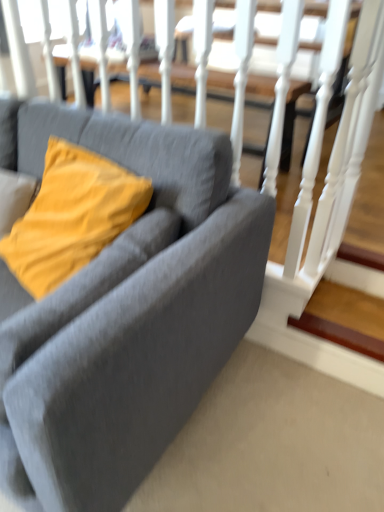
Question: From a real-world perspective, is wooden at lower right physically located above or below matte yellow pillow at left?

Choices:
 (A) above
 (B) below

Answer: (B)

Question: Does point (339, 343) appear closer or farther from the camera than point (119, 198)?

Choices:
 (A) closer
 (B) farther

Answer: (B)

Question: Considering the real-world distances, which object is closest to the matte gray couch at center?

Choices:
 (A) wooden at lower right
 (B) matte yellow pillow at left

Answer: (B)

Question: Estimate the real-world distances between objects in this image. Which object is farther from the wooden at lower right?

Choices:
 (A) matte yellow pillow at left
 (B) matte gray couch at center

Answer: (A)